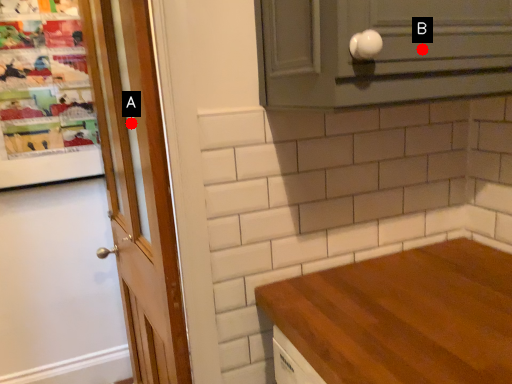
Question: Two points are circled on the image, labeled by A and B beside each circle. Which point is farther from the camera taking this photo?

Choices:
 (A) A is further
 (B) B is further

Answer: (A)